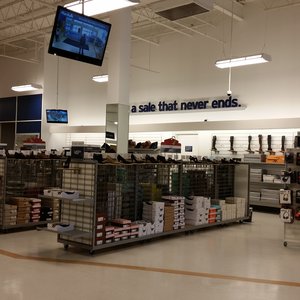
Identify the location of end shelves. This screenshot has width=300, height=300. (78, 236), (82, 199).